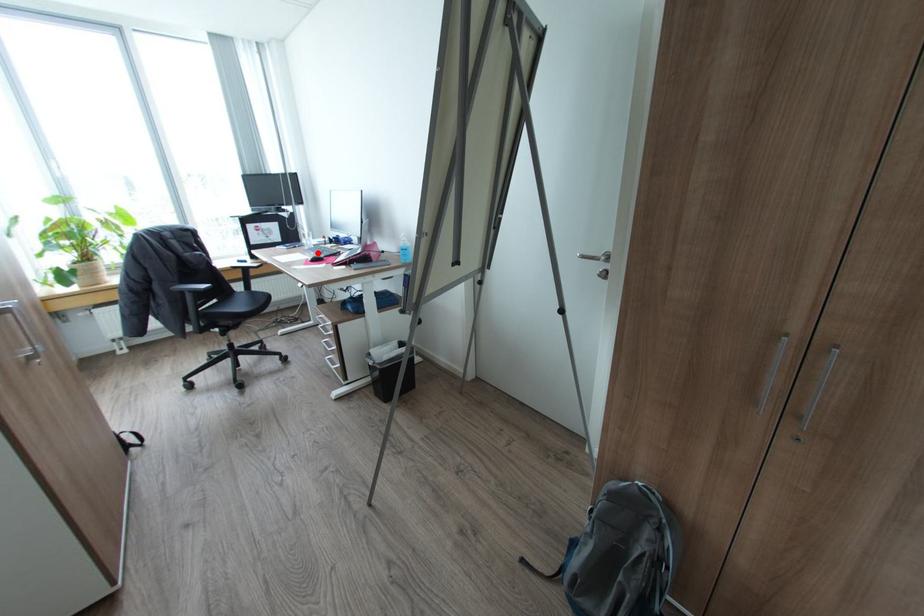
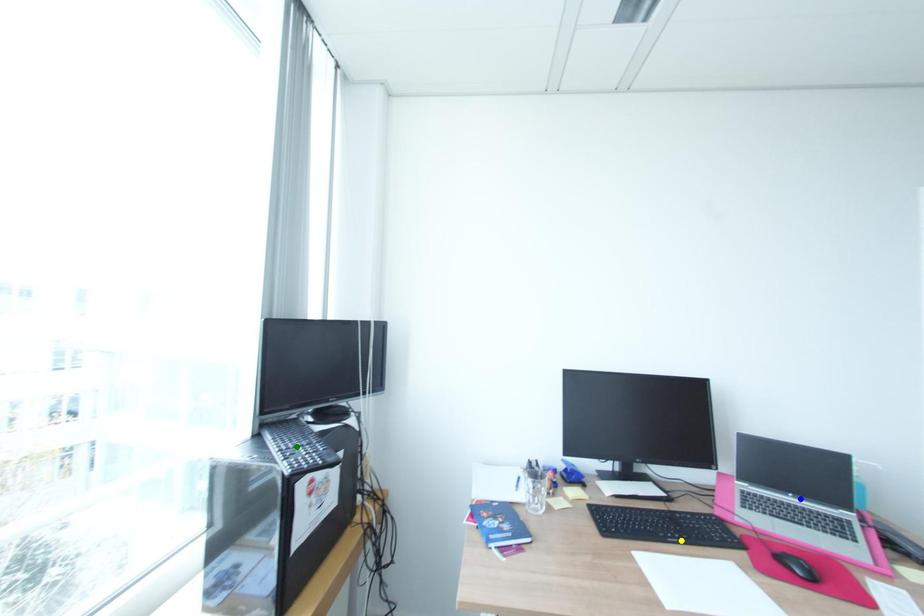
Question: I am providing you with two images of the same scene from different viewpoints. A red point is marked on the first image. You are given multiple points on the second image. Can you choose the point in image 2 that corresponds to the point in image 1?

Choices:
 (A) green point
 (B) yellow point
 (C) blue point

Answer: (B)